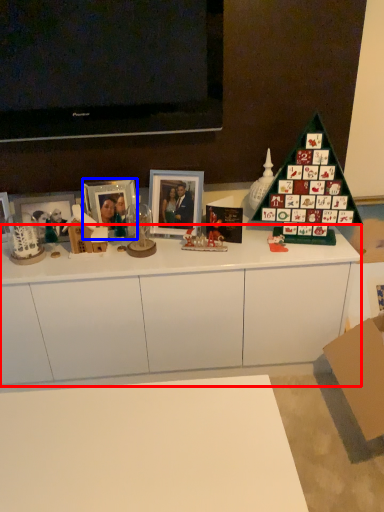
Question: Among these objects, which one is nearest to the camera, cabinetry (highlighted by a red box) or picture frame (highlighted by a blue box)?

Choices:
 (A) cabinetry
 (B) picture frame

Answer: (A)